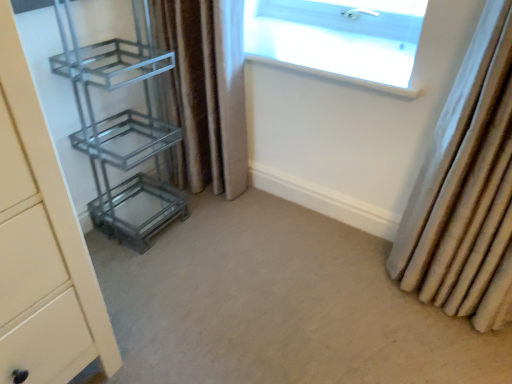
You are a GUI agent. You are given a task and a screenshot of the screen. Output one action in this format:
    pyautogui.click(x=<x>, y=<y>)
    Task: Click on the empty space that is ontop of beige carpet at center (from a real-world perspective)
    Image resolution: width=512 pixels, height=384 pixels.
    Given the screenshot: What is the action you would take?
    pyautogui.click(x=263, y=299)